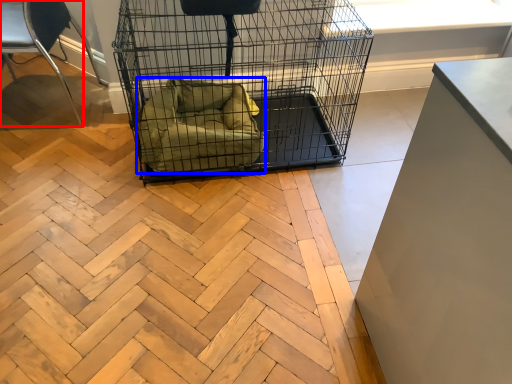
Question: Which of the following is the closest to the observer, chair (highlighted by a red box) or dog bed (highlighted by a blue box)?

Choices:
 (A) chair
 (B) dog bed

Answer: (A)